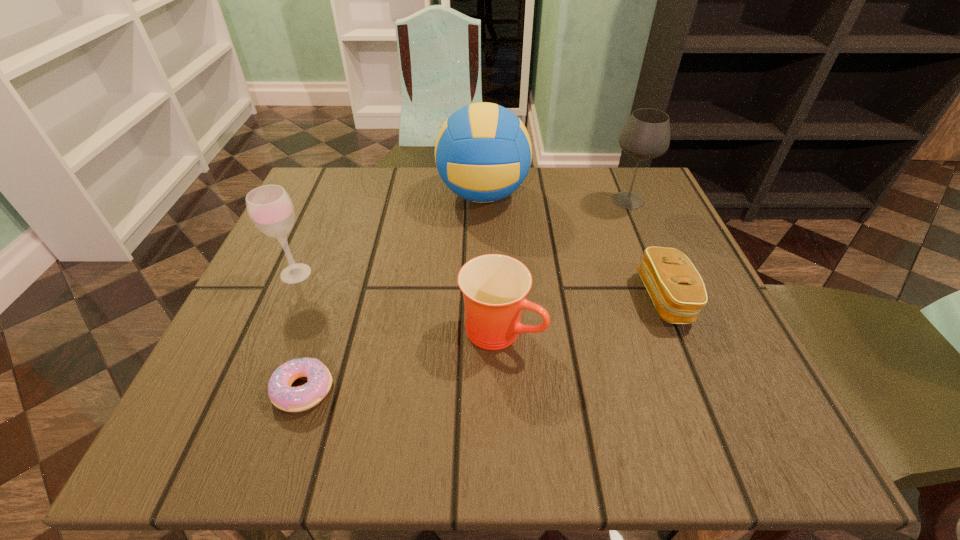
Where is `object that is the closest one to the nearer wineglass`? object that is the closest one to the nearer wineglass is located at coordinates (291, 399).

I want to click on vacant region that satisfies the following two spatial constraints: 1. on the back side of the third shortest object; 2. on the right side of the doughnut, so click(323, 330).